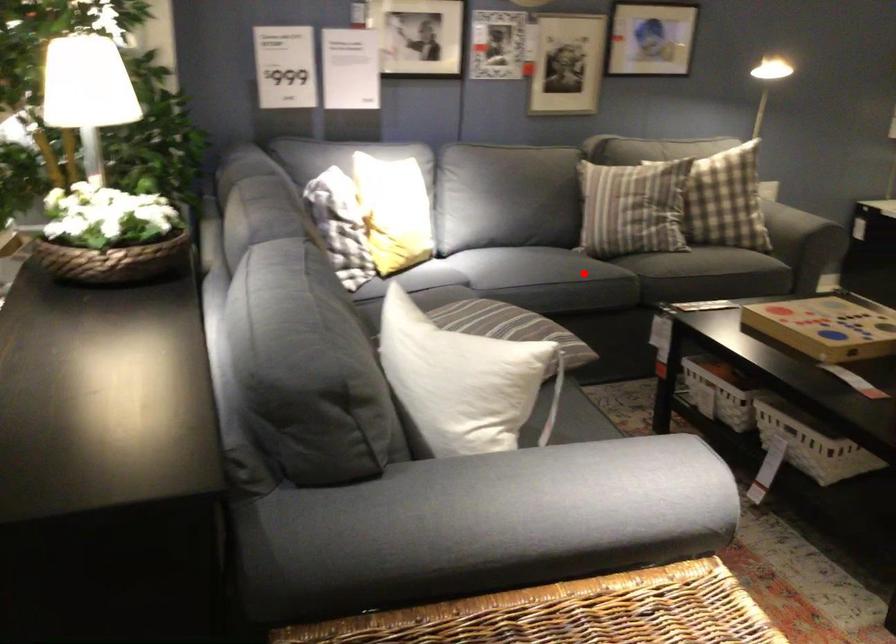
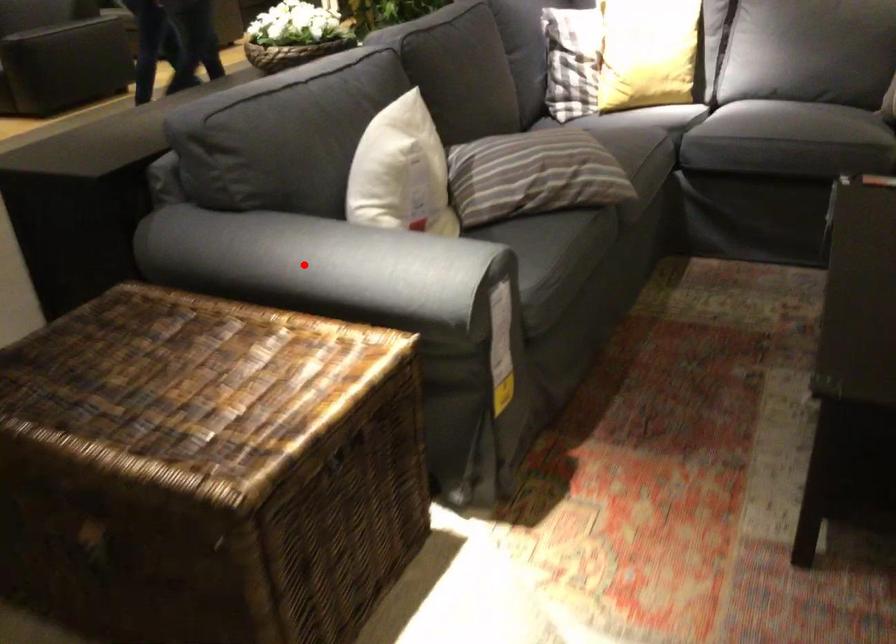
I am providing you with two images of the same scene from different viewpoints. A red point is marked on the first image and another point is marked on the second image. Do the highlighted points in image1 and image2 indicate the same real-world spot?

No